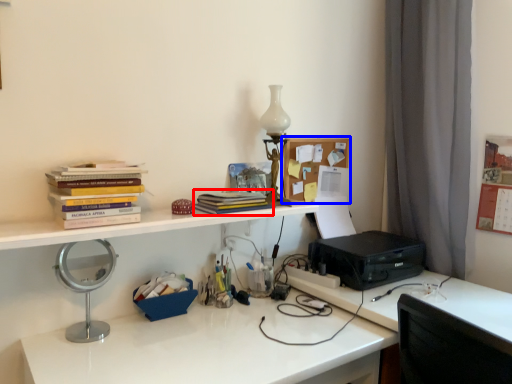
Question: Which of the following is the farthest to the observer, book (highlighted by a red box) or shelf (highlighted by a blue box)?

Choices:
 (A) book
 (B) shelf

Answer: (B)